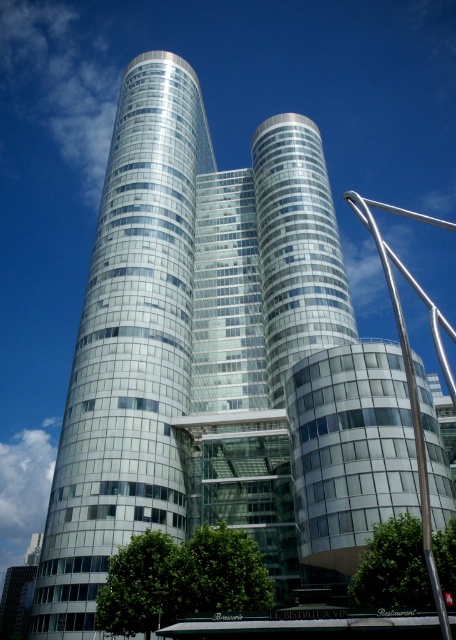
Can you confirm if glassy silver tower at center is thinner than silver metallic pole at right?

Yes, glassy silver tower at center is thinner than silver metallic pole at right.

Is point (124, 480) behind point (369, 220)?

Yes, it is.

Locate an element on the screen. This screenshot has height=640, width=456. glassy silver tower at center is located at coordinates (128, 348).